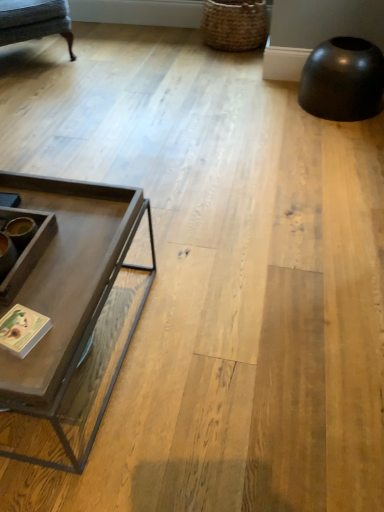
This screenshot has width=384, height=512. Find the location of `vacant space that is in between woven brown basket at upper right and textured gray fabric swivel chair at upper left`. vacant space that is in between woven brown basket at upper right and textured gray fabric swivel chair at upper left is located at coordinates (135, 51).